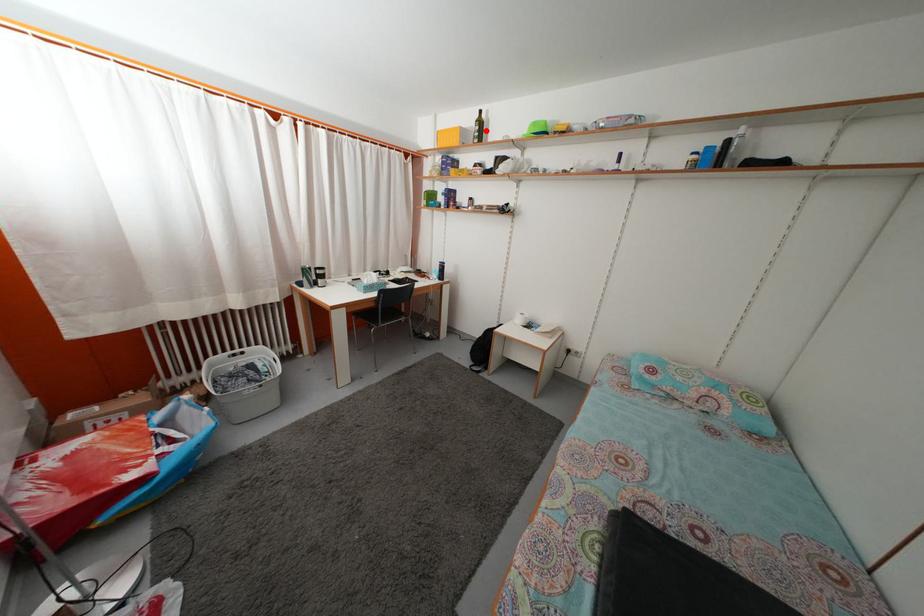
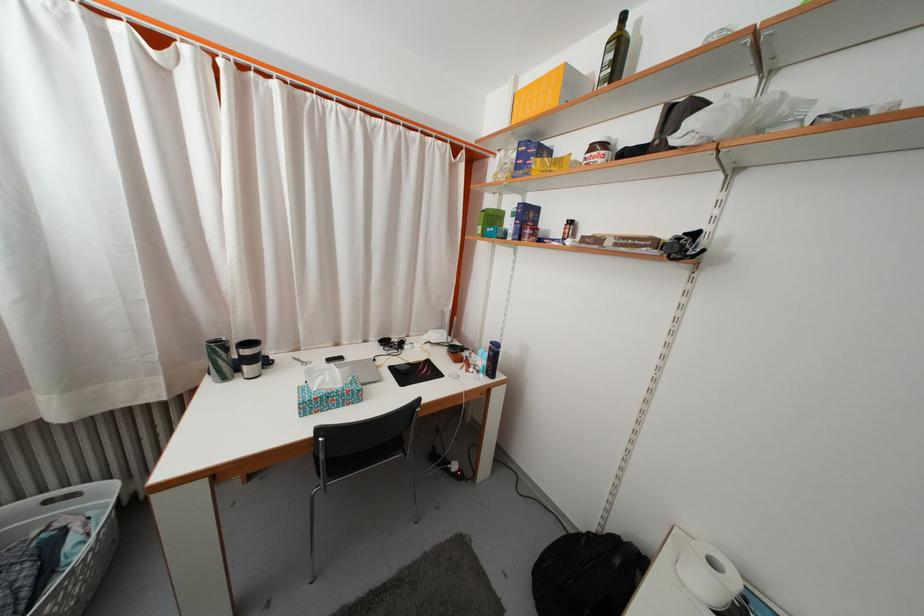
Question: I am providing you with two images of the same scene from different viewpoints. Given a red point in image1, look at the same physical point in image2. Is it:

Choices:
 (A) Closer to the viewpoint
 (B) Farther from the viewpoint

Answer: (B)